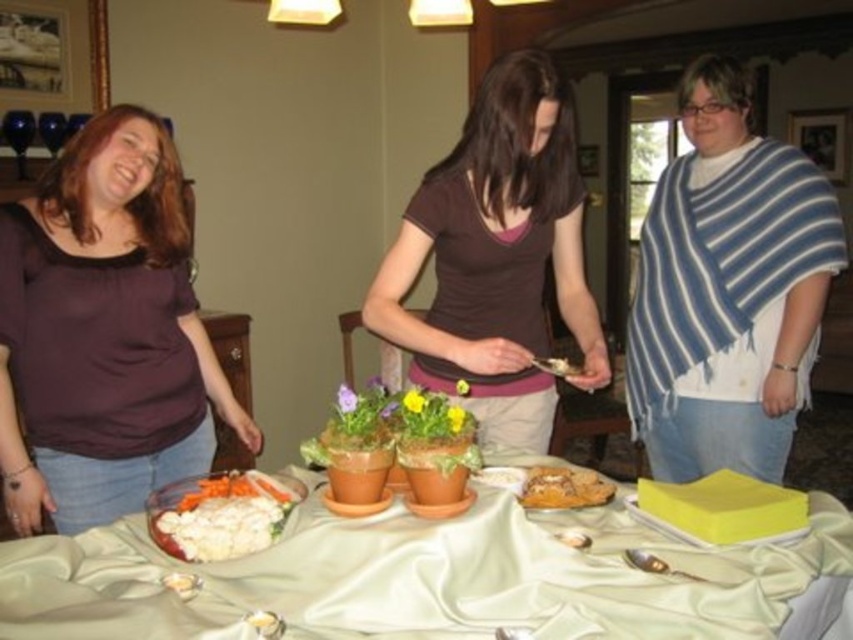
Between point (32, 424) and point (689, 150), which one is positioned in front?

Positioned in front is point (32, 424).

Is point (202, 432) positioned behind point (798, 234)?

No.

Does point (73, 202) lie in front of point (683, 378)?

Yes, point (73, 202) is closer to viewer.

You are a GUI agent. You are given a task and a screenshot of the screen. Output one action in this format:
    pyautogui.click(x=<x>, y=<y>)
    Task: Click on the matte purple shirt at left
    Image resolution: width=853 pixels, height=640 pixels.
    Given the screenshot: What is the action you would take?
    pyautogui.click(x=103, y=333)

Is brown matte shirt at center below golden brown bread at center?

Incorrect, brown matte shirt at center is not positioned below golden brown bread at center.

Does brown matte shirt at center have a lesser height compared to golden brown bread at center?

Incorrect, brown matte shirt at center's height does not fall short of golden brown bread at center's.

This screenshot has height=640, width=853. In order to click on brown matte shirt at center in this screenshot , I will do `click(497, 257)`.

Can you confirm if matte purple shirt at left is positioned above golden brown bread at center?

Yes, matte purple shirt at left is above golden brown bread at center.

Which is more to the left, matte purple shirt at left or golden brown bread at center?

From the viewer's perspective, matte purple shirt at left appears more on the left side.

Which is behind, point (212, 403) or point (558, 486)?

The point (212, 403) is behind.

Image resolution: width=853 pixels, height=640 pixels. In order to click on matte purple shirt at left in this screenshot , I will do `click(103, 333)`.